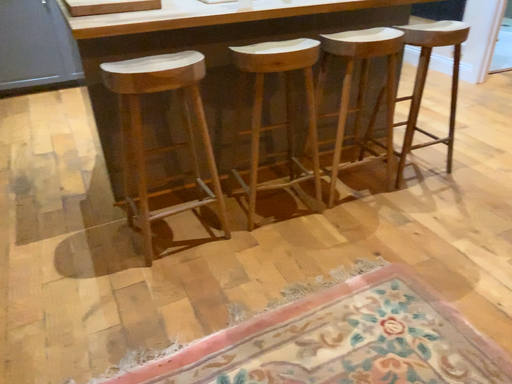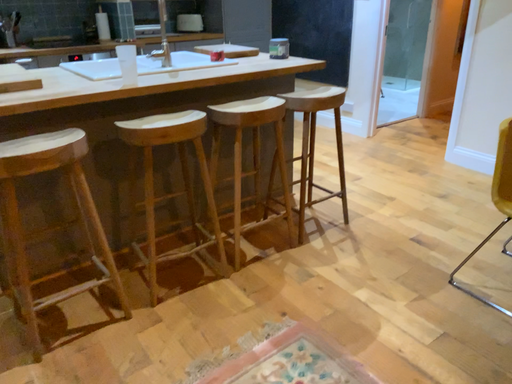
Question: Which way did the camera rotate in the video?

Choices:
 (A) rotated left
 (B) rotated right

Answer: (B)